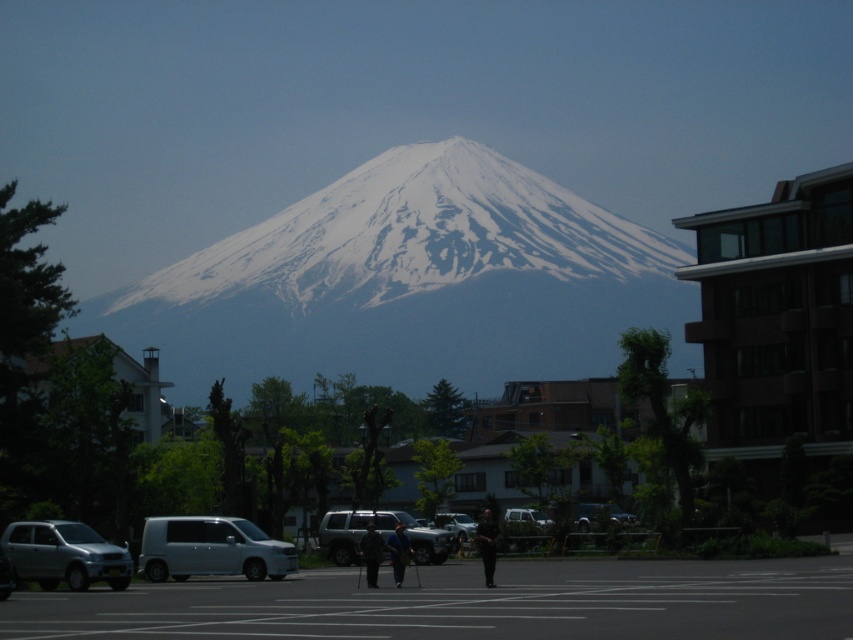
You are standing at the parking lot and want to take a photo of the snow capped mountain. There are two points marked in the scene, point A at coordinates point (x=190, y=522) and point B at coordinates point (x=402, y=577). Which point should you stand at to get a better view of the mountain without any obstructions?

You should stand at point A at coordinates point (x=190, y=522) because it is closer to the camera and less likely to be obstructed by foreground elements like trees or buildings compared to point B, which is further away from the camera and might be blocked.